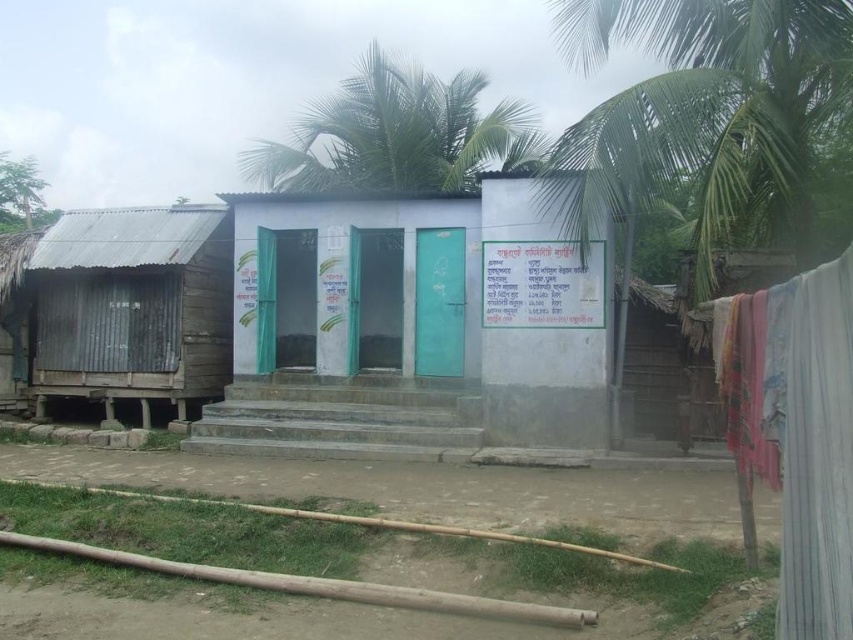
The image size is (853, 640). Describe the element at coordinates (412, 326) in the screenshot. I see `white painted concrete toilet at center` at that location.

Based on the photo, does white painted concrete toilet at center have a greater width compared to white fabric at lower right?

Yes, white painted concrete toilet at center is wider than white fabric at lower right.

Image resolution: width=853 pixels, height=640 pixels. Describe the element at coordinates (412, 326) in the screenshot. I see `white painted concrete toilet at center` at that location.

This screenshot has height=640, width=853. What are the coordinates of `white painted concrete toilet at center` in the screenshot? It's located at (412, 326).

Identify the location of green leafy palm tree at upper right. Image resolution: width=853 pixels, height=640 pixels. (706, 112).

This screenshot has height=640, width=853. What do you see at coordinates (706, 112) in the screenshot?
I see `green leafy palm tree at upper right` at bounding box center [706, 112].

What are the coordinates of `green leafy palm tree at upper right` in the screenshot? It's located at (706, 112).

Is white painted concrete toilet at center further to camera compared to rusty corrugated metal hut at left?

Yes, white painted concrete toilet at center is further from the viewer.

This screenshot has height=640, width=853. I want to click on white painted concrete toilet at center, so click(x=412, y=326).

Identify the location of white painted concrete toilet at center. (412, 326).